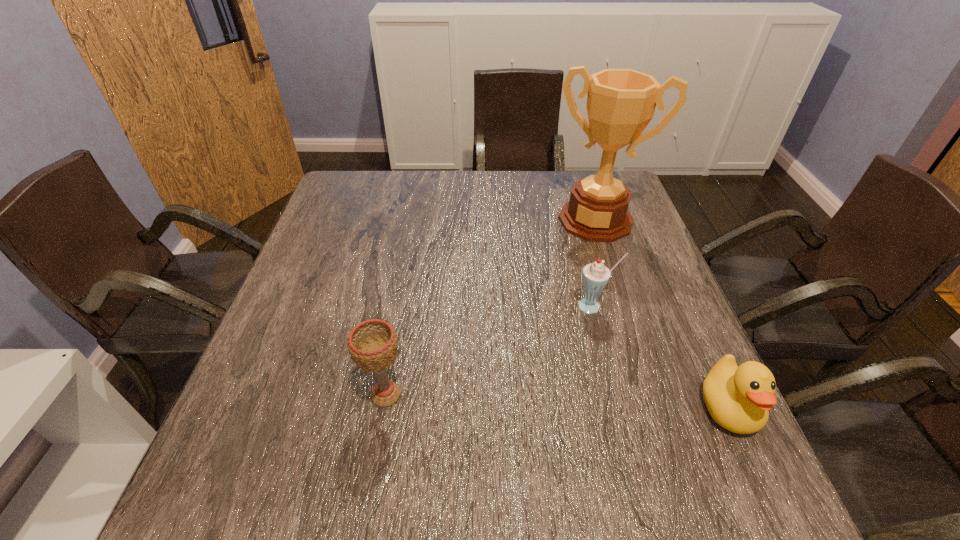
At what (x,y) coordinates should I click in order to perform the action: click on vacant space at the far edge of the desktop. Please return your answer as a coordinate pair (x, y). Looking at the image, I should click on (434, 204).

In the image, there is a desktop. At what (x,y) coordinates should I click in order to perform the action: click on free space at the near edge. Please return your answer as a coordinate pair (x, y). Looking at the image, I should click on (633, 450).

In the image, there is a desktop. At what (x,y) coordinates should I click in order to perform the action: click on vacant space at the left edge. Please return your answer as a coordinate pair (x, y). The height and width of the screenshot is (540, 960). Looking at the image, I should click on (310, 390).

At what (x,y) coordinates should I click in order to perform the action: click on vacant point at the right edge. Please return your answer as a coordinate pair (x, y). The width and height of the screenshot is (960, 540). Looking at the image, I should click on (610, 252).

At what (x,y) coordinates should I click in order to perform the action: click on vacant region at the far left corner of the desktop. Please return your answer as a coordinate pair (x, y). The image size is (960, 540). Looking at the image, I should click on (365, 198).

Find the location of a particular element. This screenshot has width=960, height=540. vacant space that is in between the milkshake and the duck is located at coordinates (660, 356).

At what (x,y) coordinates should I click in order to perform the action: click on vacant region between the chalice and the milkshake. Please return your answer as a coordinate pair (x, y). This screenshot has height=540, width=960. Looking at the image, I should click on (490, 350).

This screenshot has width=960, height=540. I want to click on vacant region between the duck and the leftmost object, so click(557, 401).

Identify the location of free point between the chalice and the tallest object. Image resolution: width=960 pixels, height=540 pixels. (491, 307).

Image resolution: width=960 pixels, height=540 pixels. Identify the location of vacant space that's between the leftmost object and the tallest object. (491, 307).